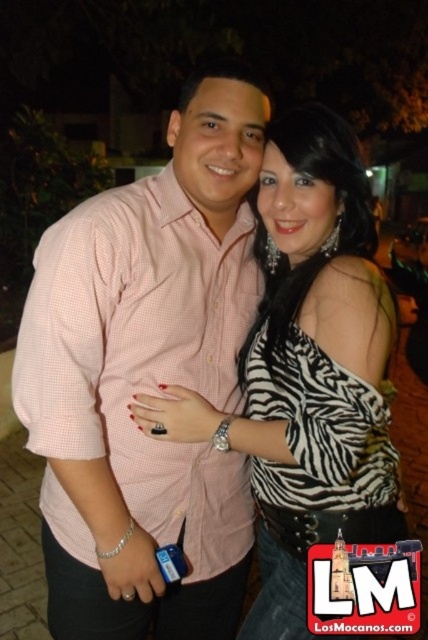
You are a photographer trying to decide which clothing item to focus on in the image. The scene has a pink checkered shirt at center and a zebra print blouse at center. Which clothing item is larger in size?

The pink checkered shirt at center is bigger than the zebra print blouse at center, so the photographer should focus on the pink checkered shirt at center as it is larger in size.

You are a photographer trying to capture a clear shot of both the pink checkered shirt at center and the zebra print blouse at center. Which one is closer to the camera?

The pink checkered shirt at center is closer to the camera because the zebra print blouse at center is behind it.